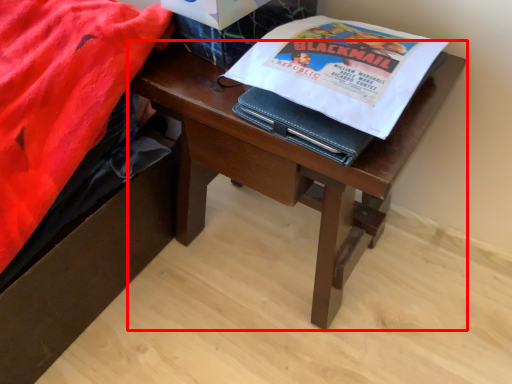
Question: Considering the relative positions of desk (annotated by the red box) and paperback book in the image provided, where is desk (annotated by the red box) located with respect to the staircase?

Choices:
 (A) right
 (B) left

Answer: (B)